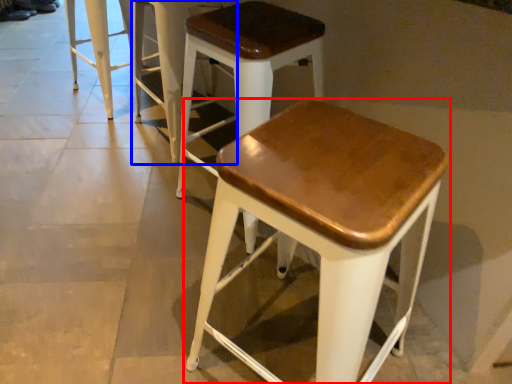
Question: Which object appears farthest to the camera in this image, stool (highlighted by a red box) or stool (highlighted by a blue box)?

Choices:
 (A) stool
 (B) stool

Answer: (B)